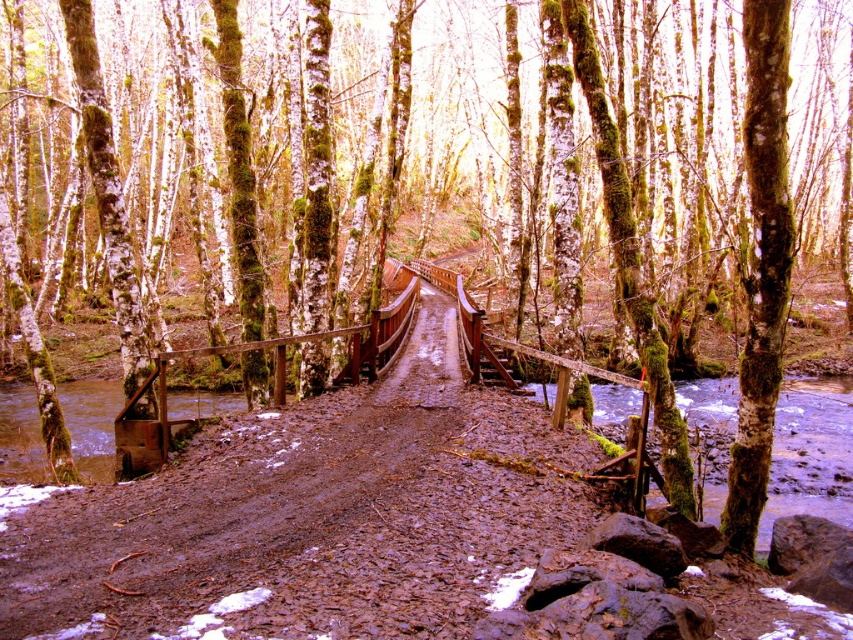
You are planning to cross the forest path and need to know which area is bigger between the brown textured dirt track at center and the clear water at lower right. Which one is larger?

The brown textured dirt track at center has a larger size compared to the clear water at lower right, so the dirt track is bigger.

You are standing at the wooden bridge in the forest scene. You notice two points marked in the image. Which point, point (529, 474) or point (759, 541), is closer to you?

Point (529, 474) is closer to the viewer than point (759, 541).

You are a hiker who wants to cross the wooden bridge in the forest. The bridge is over a muddy path. You notice the brown textured dirt track at center and the clear water at lower right. Which object is located higher in elevation?

The brown textured dirt track at center is above clear water at lower right, so it is higher in elevation than the clear water at lower right.